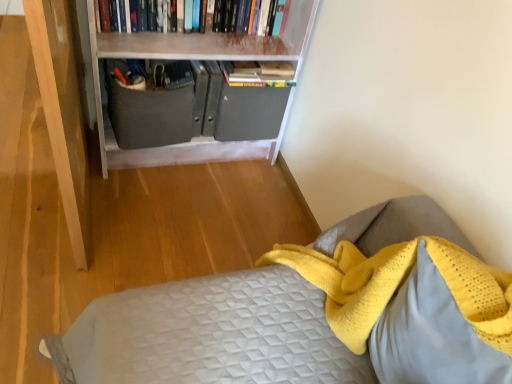
Question: Considering the relative sizes of white matte bookcase at upper center and hardcover books at upper center in the image provided, is white matte bookcase at upper center bigger than hardcover books at upper center?

Choices:
 (A) yes
 (B) no

Answer: (A)

Question: From a real-world perspective, is white matte bookcase at upper center below hardcover books at upper center?

Choices:
 (A) yes
 (B) no

Answer: (A)

Question: Can you confirm if white matte bookcase at upper center is positioned to the right of hardcover books at upper center?

Choices:
 (A) yes
 (B) no

Answer: (B)

Question: Would you say white matte bookcase at upper center contains hardcover books at upper center?

Choices:
 (A) no
 (B) yes

Answer: (B)

Question: Is white matte bookcase at upper center closer to the viewer compared to hardcover books at upper center?

Choices:
 (A) yes
 (B) no

Answer: (A)

Question: Can you confirm if white matte bookcase at upper center is taller than hardcover books at upper center?

Choices:
 (A) yes
 (B) no

Answer: (A)

Question: Is matte gray drawer at center facing towards hardcover books at upper center?

Choices:
 (A) yes
 (B) no

Answer: (B)

Question: Does matte gray drawer at center lie in front of hardcover books at upper center?

Choices:
 (A) no
 (B) yes

Answer: (A)

Question: Considering the relative sizes of matte gray drawer at center and hardcover books at upper center in the image provided, is matte gray drawer at center wider than hardcover books at upper center?

Choices:
 (A) yes
 (B) no

Answer: (A)

Question: Considering the relative sizes of matte gray drawer at center and hardcover books at upper center in the image provided, is matte gray drawer at center shorter than hardcover books at upper center?

Choices:
 (A) yes
 (B) no

Answer: (B)

Question: Does matte gray drawer at center have a greater height compared to hardcover books at upper center?

Choices:
 (A) no
 (B) yes

Answer: (B)

Question: From the image's perspective, does matte gray drawer at center appear higher than hardcover books at upper center?

Choices:
 (A) yes
 (B) no

Answer: (B)

Question: Does white matte bookcase at upper center have a larger size compared to yellow knitted pillow at lower right?

Choices:
 (A) yes
 (B) no

Answer: (A)